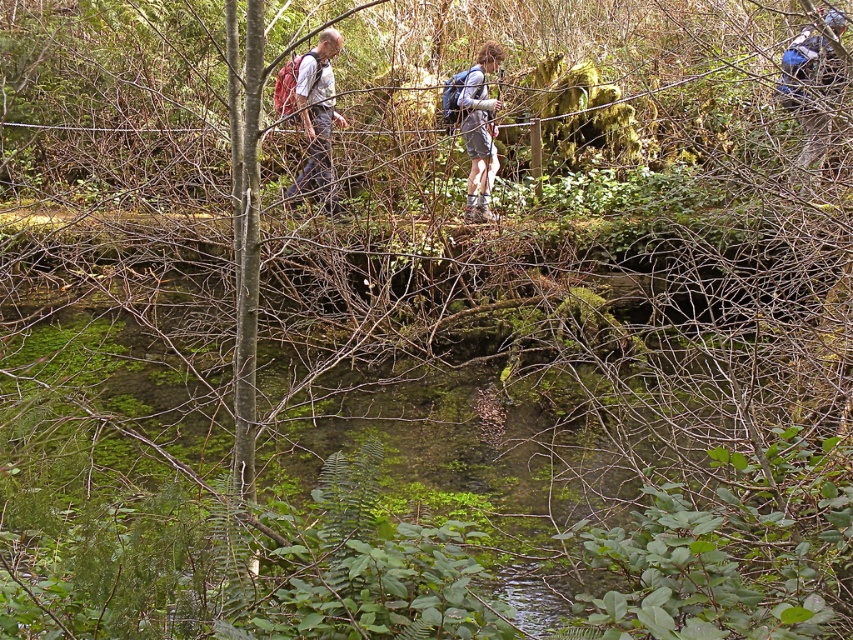
Question: Is matte red backpack at upper left positioned behind matte gray shorts at center?

Choices:
 (A) yes
 (B) no

Answer: (B)

Question: Is matte red backpack at upper left below matte gray shorts at center?

Choices:
 (A) no
 (B) yes

Answer: (B)

Question: Is matte red backpack at upper left positioned behind matte gray shorts at center?

Choices:
 (A) yes
 (B) no

Answer: (B)

Question: Which point is closer to the camera?

Choices:
 (A) matte red backpack at upper left
 (B) matte gray shorts at center

Answer: (A)

Question: Which object is farther from the camera taking this photo?

Choices:
 (A) matte red backpack at upper left
 (B) matte gray shorts at center

Answer: (B)